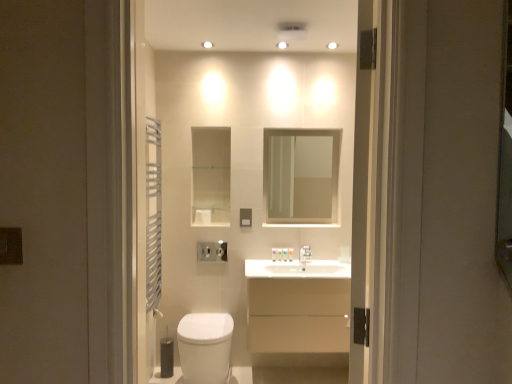
You are a GUI agent. You are given a task and a screenshot of the screen. Output one action in this format:
    pyautogui.click(x=<x>, y=<y>)
    Task: Click on the free location in front of white matte toilet paper at right, the first toilet paper positioned from the right
    Image resolution: width=512 pixels, height=384 pixels.
    Given the screenshot: What is the action you would take?
    pyautogui.click(x=338, y=263)